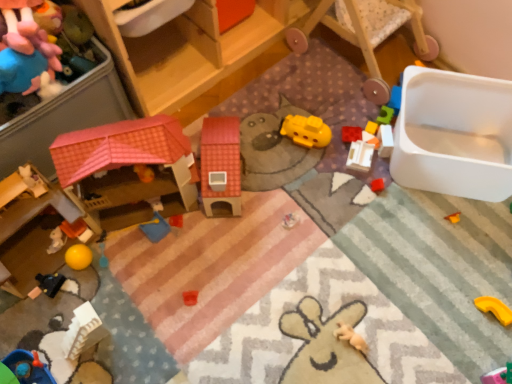
I want to click on free area in between matte plastic dollhouse at center-left, the fourth toy viewed from the left, and blue fabric toy at center, acting as the ninth toy starting from the right, so click(168, 238).